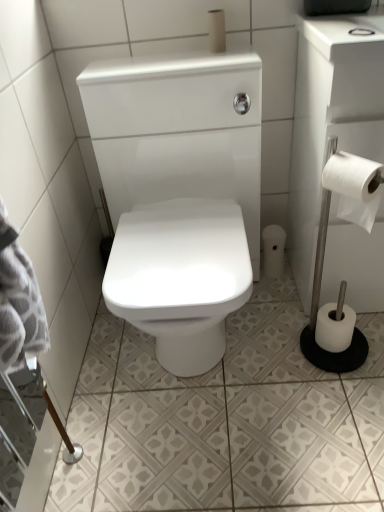
What is the approximate width of white paper roll at lower right, the 3th toilet paper in the right-to-left sequence?

white paper roll at lower right, the 3th toilet paper in the right-to-left sequence, is 3.50 inches wide.

I want to click on white matte toilet paper at upper center, the 2th toilet paper from the front, so click(x=217, y=30).

This screenshot has height=512, width=384. I want to click on white paper at right, positioned as the fourth toilet paper in back-to-front order, so click(x=354, y=187).

From the image's perspective, is white glossy ceramic tile at center above or below white paper roll at lower right, the 3th toilet paper in the right-to-left sequence?

Based on their image positions, white glossy ceramic tile at center is located beneath white paper roll at lower right, the 3th toilet paper in the right-to-left sequence.

Is the position of white glossy ceramic tile at center less distant than that of white paper roll at lower right, the 3th toilet paper in the right-to-left sequence?

Yes.

Is point (362, 325) closer or farther from the camera than point (276, 273)?

Clearly, point (362, 325) is closer to the camera than point (276, 273).

From a real-world perspective, which is physically above, white glossy ceramic tile at center or white paper roll at lower right, the third toilet paper from the top?

white paper roll at lower right, the third toilet paper from the top.

Is white paper at right, which ranks as the 1th toilet paper in front-to-back order, placed right next to white glossy toilet at center?

white paper at right, which ranks as the 1th toilet paper in front-to-back order, is not next to white glossy toilet at center, and they're not touching.

Which is closer to the camera, (x=361, y=221) or (x=176, y=89)?

Point (x=361, y=221) is positioned closer to the camera compared to point (x=176, y=89).

From the image's perspective, which one is positioned lower, white paper at right, acting as the 2th toilet paper starting from the top, or white glossy toilet at center?

white glossy toilet at center is shown below in the image.

Can white glossy toilet at center be found inside white paper at right, acting as the 2th toilet paper starting from the top?

Actually, white glossy toilet at center is outside white paper at right, acting as the 2th toilet paper starting from the top.

From the image's perspective, which toilet paper is the 3rd one above the white matte toilet paper at lower right, acting as the fourth toilet paper starting from the top? Please provide its 2D coordinates.

[(217, 30)]

Is white matte toilet paper at lower right, placed as the third toilet paper when sorted from front to back, not within white matte toilet paper at upper center, acting as the fourth toilet paper starting from the right?

Yes, white matte toilet paper at lower right, placed as the third toilet paper when sorted from front to back, is located beyond the bounds of white matte toilet paper at upper center, acting as the fourth toilet paper starting from the right.

Can you confirm if white matte toilet paper at lower right, positioned as the 2th toilet paper in back-to-front order, is positioned to the right of white matte toilet paper at upper center, marked as the 3th toilet paper in a back-to-front arrangement?

Result: Yes.

In the scene shown: Considering the sizes of objects white paper at right, the 3th toilet paper in the left-to-right sequence, and white matte toilet paper at lower right, the 1th toilet paper in the bottom-to-top sequence, in the image provided, who is bigger, white paper at right, the 3th toilet paper in the left-to-right sequence, or white matte toilet paper at lower right, the 1th toilet paper in the bottom-to-top sequence,?

white paper at right, the 3th toilet paper in the left-to-right sequence, is bigger.

Looking at this image, is white paper at right, positioned as the fourth toilet paper in back-to-front order, not near white matte toilet paper at lower right, positioned as the 2th toilet paper in back-to-front order?

Actually, white paper at right, positioned as the fourth toilet paper in back-to-front order, and white matte toilet paper at lower right, positioned as the 2th toilet paper in back-to-front order, are a little close together.

Is white paper at right, the second toilet paper viewed from the right, surrounding white matte toilet paper at lower right, placed as the third toilet paper when sorted from front to back?

No, white matte toilet paper at lower right, placed as the third toilet paper when sorted from front to back, is not surrounded by white paper at right, the second toilet paper viewed from the right.

From the image's perspective, relative to white matte toilet paper at lower right, acting as the fourth toilet paper starting from the top, is white paper at right, the third toilet paper ordered from the bottom, above or below?

Based on their image positions, white paper at right, the third toilet paper ordered from the bottom, is located above white matte toilet paper at lower right, acting as the fourth toilet paper starting from the top.

From a real-world perspective, does white matte toilet paper at lower right, the 1th toilet paper in the bottom-to-top sequence, sit lower than white paper roll at lower right, the 1th toilet paper viewed from the back?

Yes, from a real-world perspective, white matte toilet paper at lower right, the 1th toilet paper in the bottom-to-top sequence, is below white paper roll at lower right, the 1th toilet paper viewed from the back.

Is white matte toilet paper at lower right, positioned as the 2th toilet paper in back-to-front order, oriented towards white paper roll at lower right, the 3th toilet paper in the right-to-left sequence?

No, white matte toilet paper at lower right, positioned as the 2th toilet paper in back-to-front order, is not facing towards white paper roll at lower right, the 3th toilet paper in the right-to-left sequence.

Considering the points (335, 343) and (276, 262), which point is behind, point (335, 343) or point (276, 262)?

Positioned behind is point (276, 262).

Could you tell me if white paper at right, acting as the 2th toilet paper starting from the top, is facing white matte toilet paper at upper center, the 2th toilet paper from the front?

No, white paper at right, acting as the 2th toilet paper starting from the top, is not facing towards white matte toilet paper at upper center, the 2th toilet paper from the front.

Does white paper at right, positioned as the fourth toilet paper in back-to-front order, have a larger size compared to white matte toilet paper at upper center, marked as the 3th toilet paper in a back-to-front arrangement?

Indeed, white paper at right, positioned as the fourth toilet paper in back-to-front order, has a larger size compared to white matte toilet paper at upper center, marked as the 3th toilet paper in a back-to-front arrangement.

From the image's perspective, is white paper at right, the 3th toilet paper in the left-to-right sequence, over white matte toilet paper at upper center, marked as the 3th toilet paper in a back-to-front arrangement?

Actually, white paper at right, the 3th toilet paper in the left-to-right sequence, appears below white matte toilet paper at upper center, marked as the 3th toilet paper in a back-to-front arrangement, in the image.

Can you confirm if white paper at right, the 3th toilet paper in the left-to-right sequence, is positioned to the right of white matte toilet paper at upper center, the 1th toilet paper from the top?

Yes, white paper at right, the 3th toilet paper in the left-to-right sequence, is to the right of white matte toilet paper at upper center, the 1th toilet paper from the top.

From their relative heights in the image, would you say white glossy toilet at center is taller or shorter than white paper roll at lower right, the 1th toilet paper viewed from the back?

Clearly, white glossy toilet at center is taller compared to white paper roll at lower right, the 1th toilet paper viewed from the back.

Locate an element on the screen. The image size is (384, 512). porcelain located on the left of white paper roll at lower right, the fourth toilet paper when ordered from front to back is located at coordinates (180, 192).

Between white glossy toilet at center and white paper roll at lower right, the third toilet paper from the top, which one appears on the left side from the viewer's perspective?

Positioned to the left is white glossy toilet at center.

Looking at their sizes, would you say white glossy toilet at center is wider or thinner than white paper roll at lower right, the 3th toilet paper in the right-to-left sequence?

Clearly, white glossy toilet at center has more width compared to white paper roll at lower right, the 3th toilet paper in the right-to-left sequence.

Locate an element on the screen. ceramic tile in front of the white paper roll at lower right, the 3th toilet paper in the right-to-left sequence is located at coordinates (224, 421).

You are a GUI agent. You are given a task and a screenshot of the screen. Output one action in this format:
    pyautogui.click(x=<x>, y=<y>)
    Task: Click on the porcelain on the left of white paper at right, which ranks as the 1th toilet paper in front-to-back order
    The image size is (384, 512).
    Given the screenshot: What is the action you would take?
    pyautogui.click(x=180, y=192)

In the scene shown: Considering their positions, is white glossy toilet at center positioned further to white glossy ceramic tile at center than white paper at right, the second toilet paper viewed from the right?

white paper at right, the second toilet paper viewed from the right, lies further to white glossy ceramic tile at center than the other object.

From the picture: Looking at the image, which one is located closer to white matte toilet paper at upper center, acting as the fourth toilet paper starting from the right, white paper roll at lower right, which is counted as the second toilet paper, starting from the bottom, or white glossy toilet at center?

white glossy toilet at center is closer to white matte toilet paper at upper center, acting as the fourth toilet paper starting from the right.

From the image, which object appears to be farther from white matte toilet paper at lower right, the 1th toilet paper in the bottom-to-top sequence, white paper at right, the third toilet paper ordered from the bottom, or white paper roll at lower right, which is counted as the second toilet paper, starting from the bottom?

Among the two, white paper at right, the third toilet paper ordered from the bottom, is located further to white matte toilet paper at lower right, the 1th toilet paper in the bottom-to-top sequence.

When comparing their distances from white glossy ceramic tile at center, does white glossy toilet at center or white matte toilet paper at upper center, acting as the fourth toilet paper starting from the right, seem further?

Based on the image, white matte toilet paper at upper center, acting as the fourth toilet paper starting from the right, appears to be further to white glossy ceramic tile at center.

Which object lies nearer to the anchor point white matte toilet paper at lower right, the first toilet paper from the right, white glossy ceramic tile at center or white glossy toilet at center?

Among the two, white glossy ceramic tile at center is located nearer to white matte toilet paper at lower right, the first toilet paper from the right.

Consider the image. Which object lies nearer to the anchor point white glossy ceramic tile at center, white glossy toilet at center or white matte toilet paper at lower right, acting as the fourth toilet paper starting from the top?

white matte toilet paper at lower right, acting as the fourth toilet paper starting from the top.

When comparing their distances from white matte toilet paper at lower right, the 1th toilet paper in the bottom-to-top sequence, does white paper at right, the third toilet paper ordered from the bottom, or white glossy toilet at center seem further?

white glossy toilet at center is positioned further to the anchor white matte toilet paper at lower right, the 1th toilet paper in the bottom-to-top sequence.

From the image, which object appears to be nearer to white glossy toilet at center, white matte toilet paper at lower right, placed as the third toilet paper when sorted from front to back, or white matte toilet paper at upper center, the 2th toilet paper from the front?

white matte toilet paper at upper center, the 2th toilet paper from the front, is closer to white glossy toilet at center.

Image resolution: width=384 pixels, height=512 pixels. What are the coordinates of `porcelain between white matte toilet paper at upper center, placed as the 4th toilet paper when sorted from bottom to top, and white glossy ceramic tile at center in the up-down direction` in the screenshot? It's located at (180, 192).

The width and height of the screenshot is (384, 512). In order to click on porcelain that lies between white paper at right, which ranks as the 1th toilet paper in front-to-back order, and white glossy ceramic tile at center from top to bottom in this screenshot , I will do 180,192.

Identify the location of ceramic tile between white glossy toilet at center and white matte toilet paper at lower right, the first toilet paper from the right, in the front-back direction. (224, 421).

Locate an element on the screen. Image resolution: width=384 pixels, height=512 pixels. toilet paper between white matte toilet paper at upper center, the 2th toilet paper from the front, and white glossy toilet at center in the up-down direction is located at coordinates (354, 187).